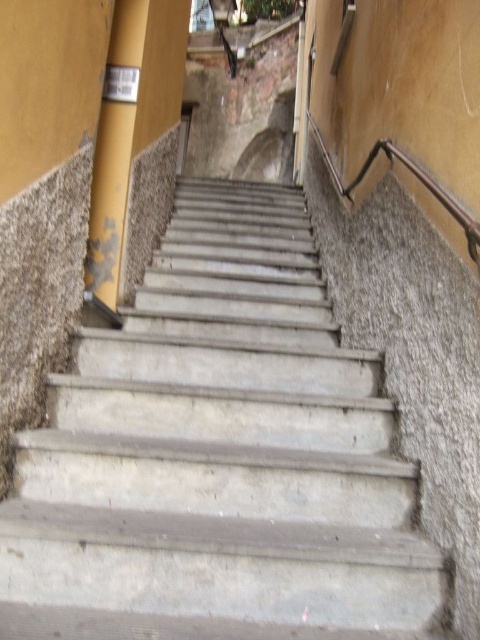
You are standing at the bottom of the stairs and want to reach the yellow matte pole at upper left. Which direction should you move relative to the concrete stairs at center to get closer to the pole?

To reach the yellow matte pole at upper left, you should move to the left side of the concrete stairs at center since the pole is positioned to the left of the stairs.

You are standing at the bottom of the concrete stairs at center and want to reach the yellow matte pole at upper left. Can you walk directly towards the pole without moving sideways?

The concrete stairs at center is in front of the yellow matte pole at upper left, so you cannot walk directly towards the pole without moving sideways because the stairs are blocking the path.

You are standing at the bottom of the concrete stairs at center and want to reach the yellow matte pole at upper left. Which direction should you move to get closer to the pole?

You should move upwards along the concrete stairs at center to get closer to the yellow matte pole at upper left since the stairs are located below the pole.